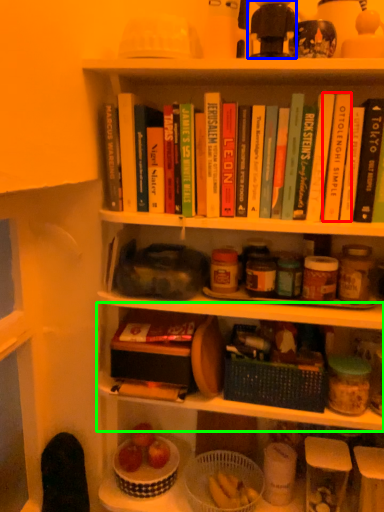
Question: Based on their relative distances, which object is nearer to paperback book (highlighted by a red box)? Choose from toy (highlighted by a blue box) and shelf (highlighted by a green box).

Choices:
 (A) toy
 (B) shelf

Answer: (A)